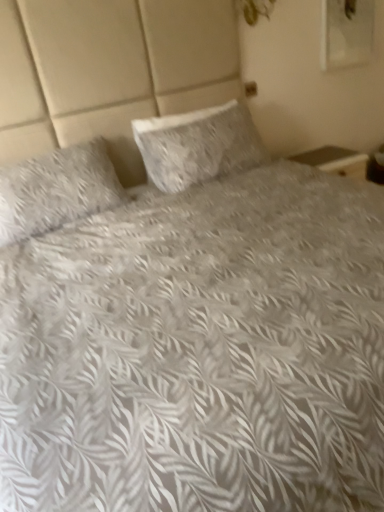
At what (x,y) coordinates should I click in order to perform the action: click on white textured pillow at center, the 2th pillow when ordered from left to right. Please return your answer as a coordinate pair (x, y). Looking at the image, I should click on (198, 145).

Measure the distance between point (139,149) and camera.

A distance of 8.39 feet exists between point (139,149) and camera.

What is the approximate height of white textured pillow at center, the 2th pillow when ordered from left to right?

white textured pillow at center, the 2th pillow when ordered from left to right, is 20.46 inches in height.

This screenshot has width=384, height=512. What do you see at coordinates (198, 145) in the screenshot?
I see `white textured pillow at center, the 2th pillow when ordered from left to right` at bounding box center [198, 145].

In order to click on fluffy white pillow at left, which ranks as the 1th pillow in left-to-right order in this screenshot , I will do (56, 190).

What do you see at coordinates (56, 190) in the screenshot? I see `fluffy white pillow at left, placed as the second pillow when sorted from right to left` at bounding box center [56, 190].

Where is `white textured pillow at center, the 2th pillow when ordered from left to right`? This screenshot has height=512, width=384. white textured pillow at center, the 2th pillow when ordered from left to right is located at coordinates (198, 145).

Does fluffy white pillow at left, which ranks as the 1th pillow in left-to-right order, appear on the right side of white textured pillow at center, the 2th pillow when ordered from left to right?

No, fluffy white pillow at left, which ranks as the 1th pillow in left-to-right order, is not to the right of white textured pillow at center, the 2th pillow when ordered from left to right.

Considering the positions of objects fluffy white pillow at left, which ranks as the 1th pillow in left-to-right order, and white textured pillow at center, which appears as the first pillow when viewed from the right, in the image provided, who is in front, fluffy white pillow at left, which ranks as the 1th pillow in left-to-right order, or white textured pillow at center, which appears as the first pillow when viewed from the right,?

fluffy white pillow at left, which ranks as the 1th pillow in left-to-right order, is closer to the camera.

Is point (73, 187) positioned behind point (238, 125)?

That is False.

From the image's perspective, does fluffy white pillow at left, which ranks as the 1th pillow in left-to-right order, appear higher than white textured pillow at center, which appears as the first pillow when viewed from the right?

Incorrect, from the image's perspective, fluffy white pillow at left, which ranks as the 1th pillow in left-to-right order, is lower than white textured pillow at center, which appears as the first pillow when viewed from the right.

From a real-world perspective, between fluffy white pillow at left, which ranks as the 1th pillow in left-to-right order, and white textured pillow at center, the 2th pillow when ordered from left to right, who is vertically higher?

fluffy white pillow at left, which ranks as the 1th pillow in left-to-right order, from a real-world perspective.

Between fluffy white pillow at left, which ranks as the 1th pillow in left-to-right order, and white textured pillow at center, the 2th pillow when ordered from left to right, which one has larger width?

With larger width is fluffy white pillow at left, which ranks as the 1th pillow in left-to-right order.

Does fluffy white pillow at left, which ranks as the 1th pillow in left-to-right order, have a lesser height compared to white textured pillow at center, the 2th pillow when ordered from left to right?

No.

Does fluffy white pillow at left, placed as the second pillow when sorted from right to left, have a smaller size compared to white textured pillow at center, which appears as the first pillow when viewed from the right?

No.

Is fluffy white pillow at left, placed as the second pillow when sorted from right to left, surrounding white textured pillow at center, the 2th pillow when ordered from left to right?

No, fluffy white pillow at left, placed as the second pillow when sorted from right to left, does not contain white textured pillow at center, the 2th pillow when ordered from left to right.

Does fluffy white pillow at left, which ranks as the 1th pillow in left-to-right order, touch white textured pillow at center, which appears as the first pillow when viewed from the right?

No, fluffy white pillow at left, which ranks as the 1th pillow in left-to-right order, is not with white textured pillow at center, which appears as the first pillow when viewed from the right.

Is fluffy white pillow at left, which ranks as the 1th pillow in left-to-right order, positioned with its back to white textured pillow at center, the 2th pillow when ordered from left to right?

fluffy white pillow at left, which ranks as the 1th pillow in left-to-right order, is not turned away from white textured pillow at center, the 2th pillow when ordered from left to right.

How many degrees apart are the facing directions of fluffy white pillow at left, which ranks as the 1th pillow in left-to-right order, and white textured pillow at center, the 2th pillow when ordered from left to right?

0.00139 degrees.

How far apart are fluffy white pillow at left, placed as the second pillow when sorted from right to left, and white textured pillow at center, the 2th pillow when ordered from left to right?

fluffy white pillow at left, placed as the second pillow when sorted from right to left, is 20.88 inches away from white textured pillow at center, the 2th pillow when ordered from left to right.

Where is `pillow below the white textured pillow at center, which appears as the first pillow when viewed from the right (from the image's perspective)`? pillow below the white textured pillow at center, which appears as the first pillow when viewed from the right (from the image's perspective) is located at coordinates (56, 190).

Is white textured pillow at center, which appears as the first pillow when viewed from the right, to the left of fluffy white pillow at left, placed as the second pillow when sorted from right to left, from the viewer's perspective?

No, white textured pillow at center, which appears as the first pillow when viewed from the right, is not to the left of fluffy white pillow at left, placed as the second pillow when sorted from right to left.

Between white textured pillow at center, which appears as the first pillow when viewed from the right, and fluffy white pillow at left, which ranks as the 1th pillow in left-to-right order, which one is positioned in front?

Positioned in front is fluffy white pillow at left, which ranks as the 1th pillow in left-to-right order.

Is point (257, 148) positioned behind point (19, 221)?

Yes.

From the image's perspective, would you say white textured pillow at center, the 2th pillow when ordered from left to right, is shown under fluffy white pillow at left, which ranks as the 1th pillow in left-to-right order?

No, from the image's perspective, white textured pillow at center, the 2th pillow when ordered from left to right, is not beneath fluffy white pillow at left, which ranks as the 1th pillow in left-to-right order.

From a real-world perspective, which object stands above the other?

From a 3D spatial view, fluffy white pillow at left, which ranks as the 1th pillow in left-to-right order, is above.

Between white textured pillow at center, which appears as the first pillow when viewed from the right, and fluffy white pillow at left, which ranks as the 1th pillow in left-to-right order, which one has larger width?

With larger width is fluffy white pillow at left, which ranks as the 1th pillow in left-to-right order.

Which of these two, white textured pillow at center, which appears as the first pillow when viewed from the right, or fluffy white pillow at left, which ranks as the 1th pillow in left-to-right order, stands taller?

fluffy white pillow at left, which ranks as the 1th pillow in left-to-right order, is taller.

Considering the sizes of objects white textured pillow at center, which appears as the first pillow when viewed from the right, and fluffy white pillow at left, which ranks as the 1th pillow in left-to-right order, in the image provided, who is smaller, white textured pillow at center, which appears as the first pillow when viewed from the right, or fluffy white pillow at left, which ranks as the 1th pillow in left-to-right order,?

With smaller size is white textured pillow at center, which appears as the first pillow when viewed from the right.

Is white textured pillow at center, which appears as the first pillow when viewed from the right, not inside fluffy white pillow at left, placed as the second pillow when sorted from right to left?

white textured pillow at center, which appears as the first pillow when viewed from the right, lies outside fluffy white pillow at left, placed as the second pillow when sorted from right to left,'s area.

Is white textured pillow at center, which appears as the first pillow when viewed from the right, with fluffy white pillow at left, placed as the second pillow when sorted from right to left?

No, white textured pillow at center, which appears as the first pillow when viewed from the right, is not next to fluffy white pillow at left, placed as the second pillow when sorted from right to left.

Is white textured pillow at center, the 2th pillow when ordered from left to right, facing towards fluffy white pillow at left, placed as the second pillow when sorted from right to left?

No, white textured pillow at center, the 2th pillow when ordered from left to right, is not facing towards fluffy white pillow at left, placed as the second pillow when sorted from right to left.

How different are the orientations of white textured pillow at center, which appears as the first pillow when viewed from the right, and fluffy white pillow at left, which ranks as the 1th pillow in left-to-right order, in degrees?

0.00139 degrees.

Measure the distance from white textured pillow at center, the 2th pillow when ordered from left to right, to fluffy white pillow at left, placed as the second pillow when sorted from right to left.

white textured pillow at center, the 2th pillow when ordered from left to right, and fluffy white pillow at left, placed as the second pillow when sorted from right to left, are 53.03 centimeters apart from each other.

Where is `pillow below the white textured pillow at center, which appears as the first pillow when viewed from the right (from the image's perspective)`? This screenshot has width=384, height=512. pillow below the white textured pillow at center, which appears as the first pillow when viewed from the right (from the image's perspective) is located at coordinates (56, 190).

Locate an element on the screen. pillow on the left of white textured pillow at center, the 2th pillow when ordered from left to right is located at coordinates (56, 190).

You are a GUI agent. You are given a task and a screenshot of the screen. Output one action in this format:
    pyautogui.click(x=<x>, y=<y>)
    Task: Click on the pillow in front of the white textured pillow at center, which appears as the first pillow when viewed from the right
    This screenshot has height=512, width=384.
    Given the screenshot: What is the action you would take?
    pyautogui.click(x=56, y=190)